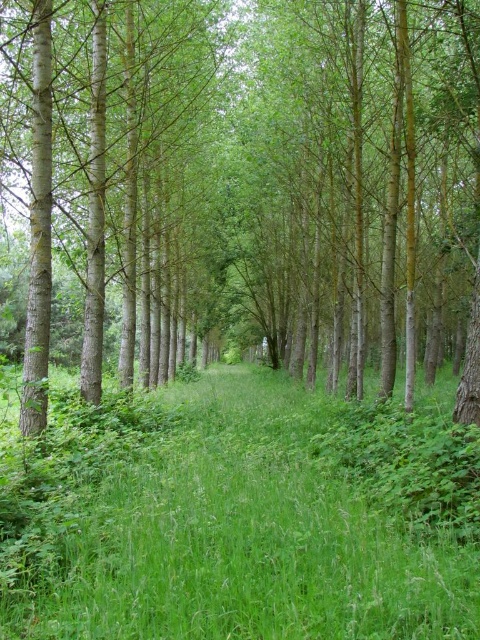
Question: Is green smooth tree at center bigger than green grassy at center?

Choices:
 (A) yes
 (B) no

Answer: (A)

Question: Does green smooth tree at center have a larger size compared to green grassy at center?

Choices:
 (A) no
 (B) yes

Answer: (B)

Question: Is the position of green smooth tree at center more distant than that of green grassy at center?

Choices:
 (A) no
 (B) yes

Answer: (B)

Question: Which point is closer to the camera taking this photo?

Choices:
 (A) (67, 86)
 (B) (144, 556)

Answer: (B)

Question: Which of the following is the farthest from the observer?

Choices:
 (A) green smooth tree at center
 (B) green grassy at center

Answer: (A)